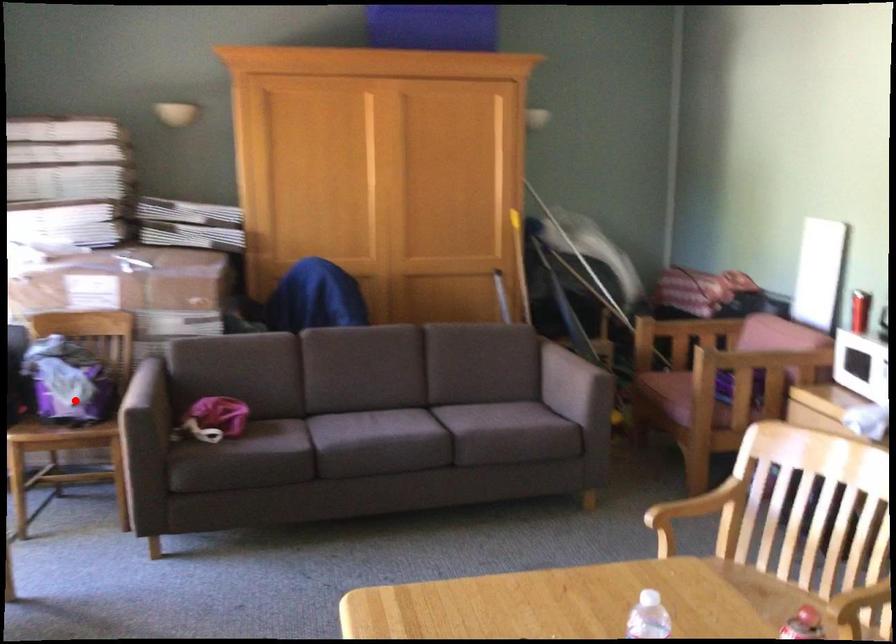
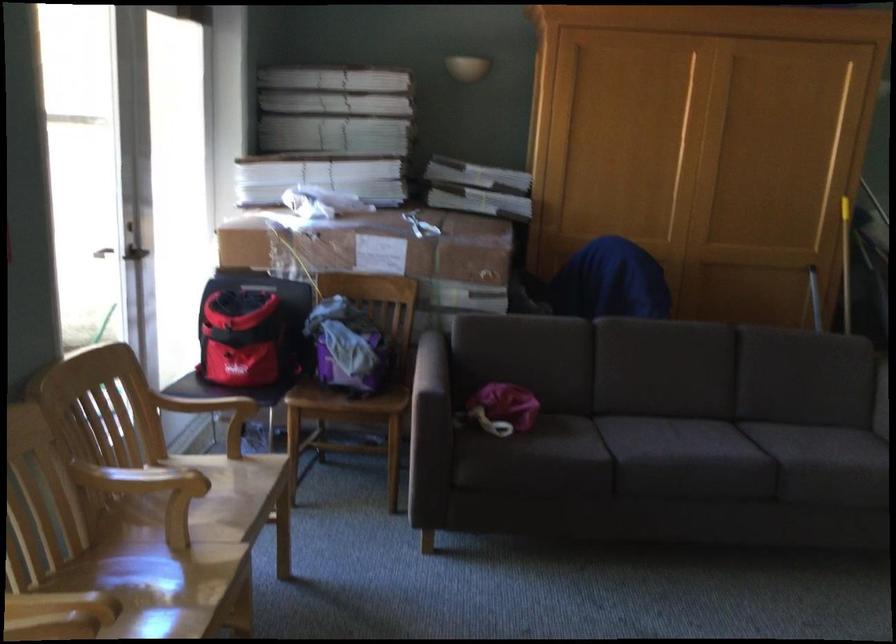
Where in the second image is the point corresponding to the highlighted location from the first image?

(352, 366)